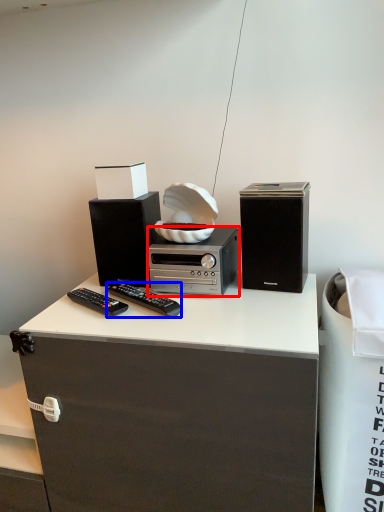
Question: Which point is closer to the camera, appliance (highlighted by a red box) or remote control (highlighted by a blue box)?

Choices:
 (A) appliance
 (B) remote control

Answer: (B)